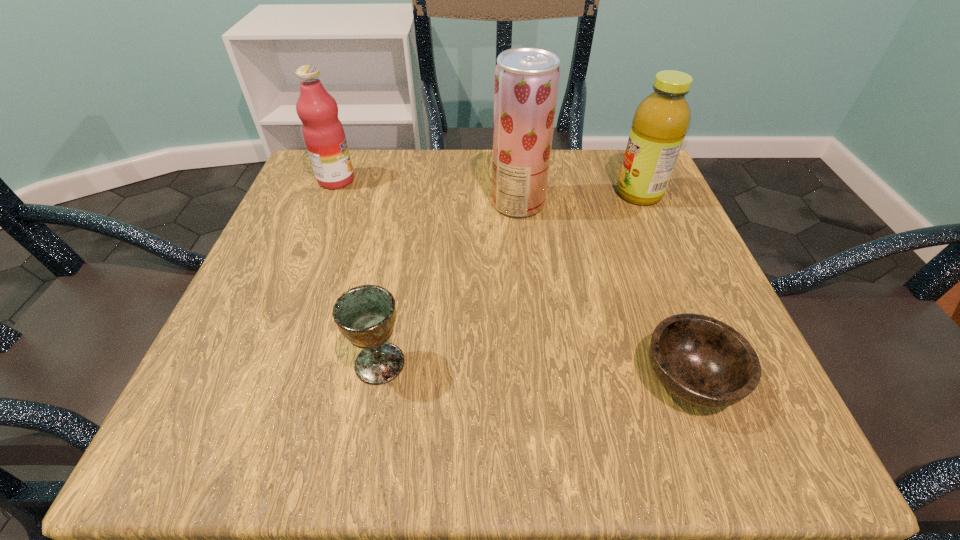
I want to click on object that is at the near right corner, so click(x=703, y=361).

This screenshot has height=540, width=960. Identify the location of free point at the far edge. (572, 190).

What are the coordinates of `vacant space at the near edge of the desktop` in the screenshot? It's located at (495, 393).

You are a GUI agent. You are given a task and a screenshot of the screen. Output one action in this format:
    pyautogui.click(x=<x>, y=<y>)
    Task: Click on the vacant space at the left edge of the desktop
    The height and width of the screenshot is (540, 960).
    Given the screenshot: What is the action you would take?
    pyautogui.click(x=270, y=242)

The image size is (960, 540). What are the coordinates of `free space at the right edge` in the screenshot? It's located at (657, 233).

Find the location of a particular element. The height and width of the screenshot is (540, 960). vacant area at the far left corner of the desktop is located at coordinates (373, 157).

Find the location of a particular element. The image size is (960, 540). free region at the near left corner of the desktop is located at coordinates (302, 414).

Identify the location of vacant space at the far right corner of the desktop. (612, 179).

I want to click on free space between the second object from left to right and the rightmost fruit juice, so click(510, 279).

Identify the location of unoccupied area between the fourth tallest object and the shortest object. The width and height of the screenshot is (960, 540). (535, 371).